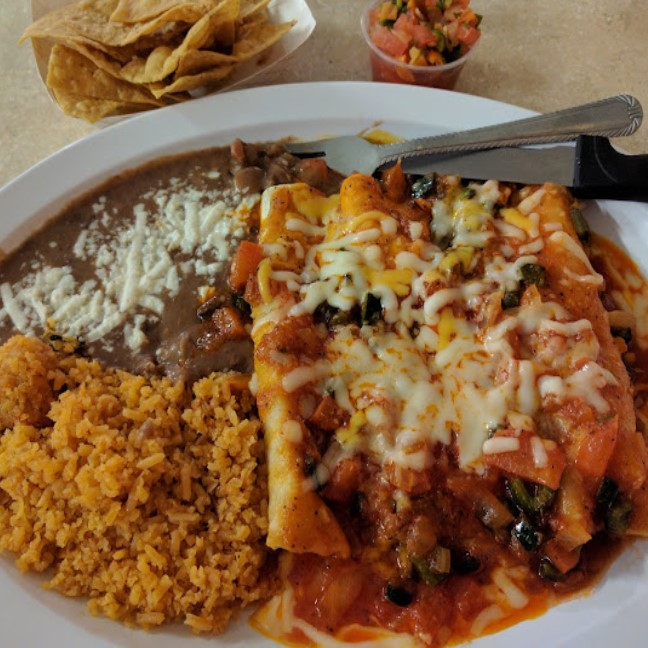
The height and width of the screenshot is (648, 648). I want to click on tabletop, so 566,54.